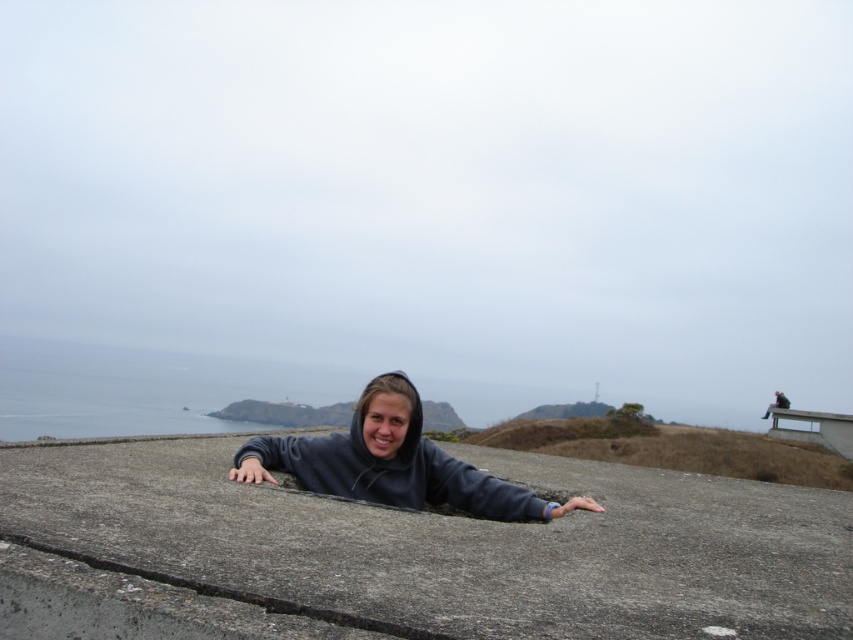
Question: Is gray concrete at center closer to camera compared to dark gray hoodie at center?

Choices:
 (A) no
 (B) yes

Answer: (B)

Question: Where is gray concrete at center located in relation to dark gray hoodie at center in the image?

Choices:
 (A) below
 (B) above

Answer: (A)

Question: Can you confirm if gray concrete at center is thinner than dark gray hoodie at center?

Choices:
 (A) no
 (B) yes

Answer: (A)

Question: Among these points, which one is nearest to the camera?

Choices:
 (A) (352, 461)
 (B) (665, 470)

Answer: (A)